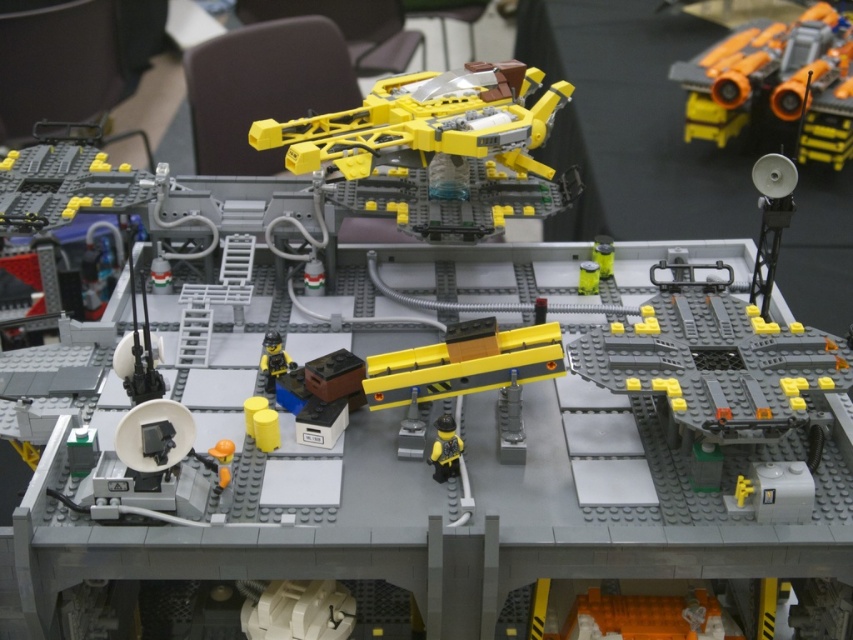
Is orange plastic toy at upper right above yellow matte figure at center?

Correct, orange plastic toy at upper right is located above yellow matte figure at center.

At what (x,y) coordinates should I click in order to perform the action: click on orange plastic toy at upper right. Please return your answer as a coordinate pair (x, y). The image size is (853, 640). Looking at the image, I should click on (776, 81).